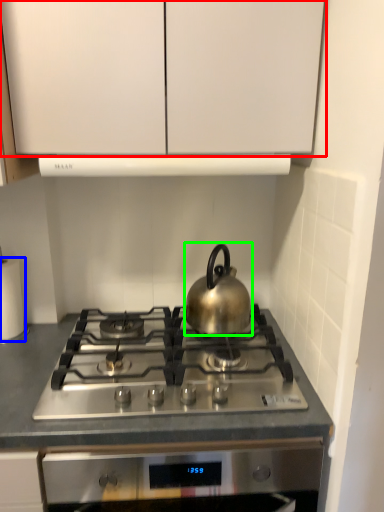
Question: Estimate the real-world distances between objects in this image. Which object is closer to cabinetry (highlighted by a red box), paper towel (highlighted by a blue box) or kettle (highlighted by a green box)?

Choices:
 (A) paper towel
 (B) kettle

Answer: (B)